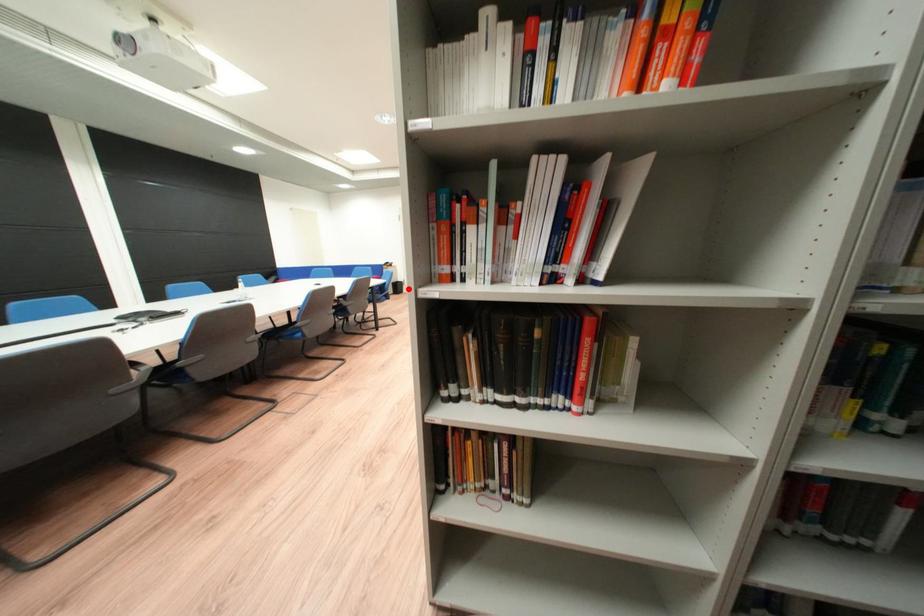
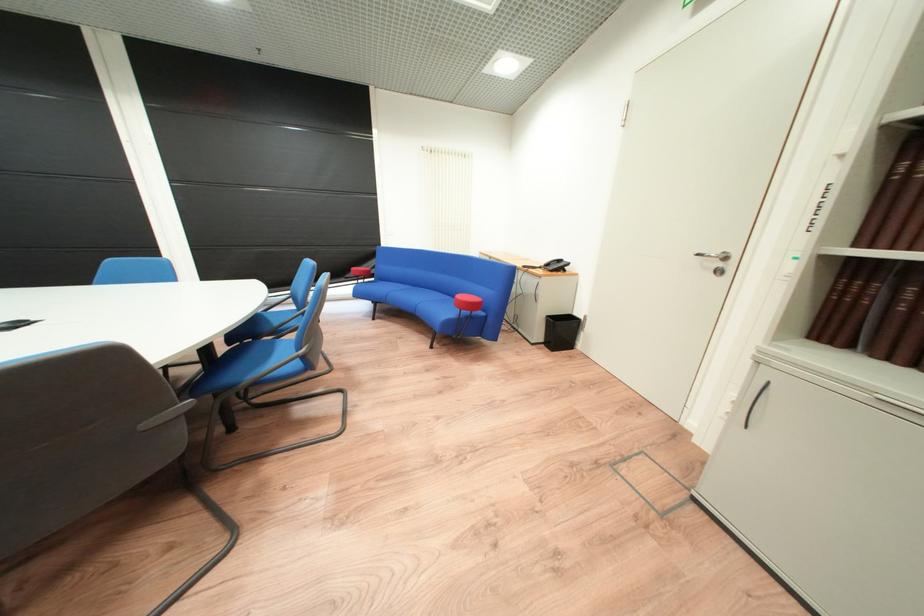
Locate, in the second image, the point that corresponds to the highlighted location in the first image.

(573, 333)